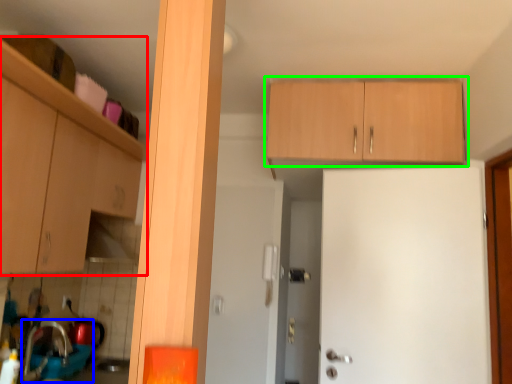
Question: Which is farther away from cabinetry (highlighted by a red box)? sink (highlighted by a blue box) or cabinetry (highlighted by a green box)?

Choices:
 (A) sink
 (B) cabinetry

Answer: (B)